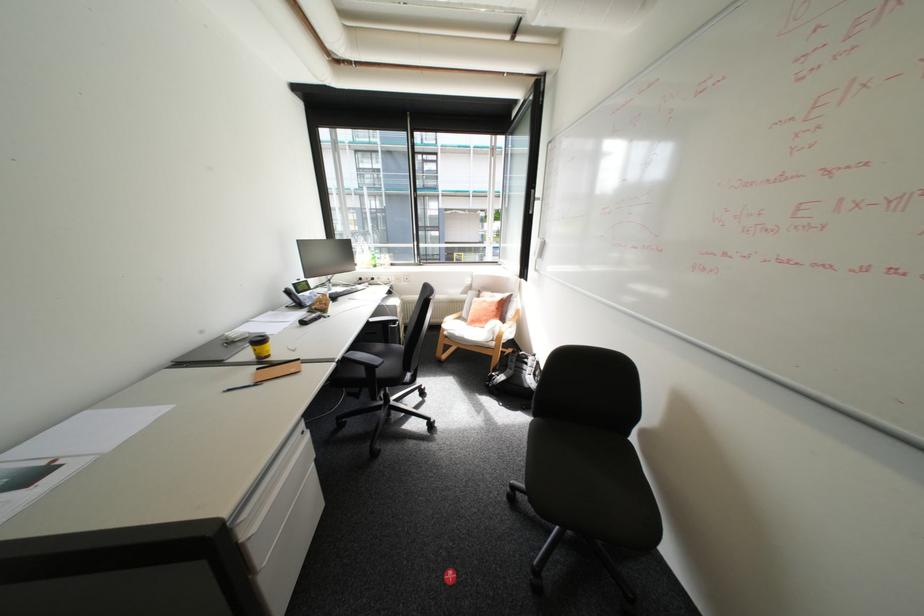
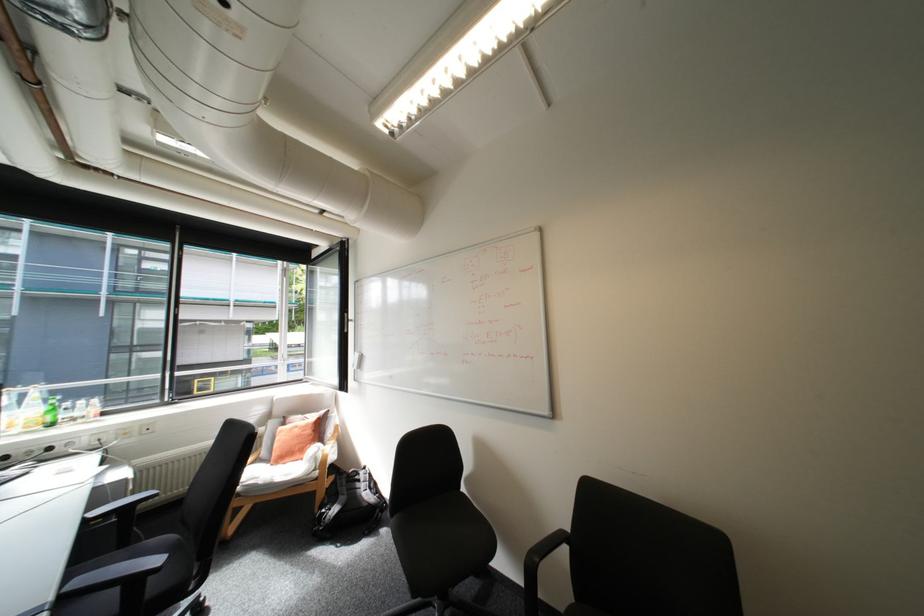
In the second image, find the point that corresponds to [507,376] in the first image.

(339, 509)